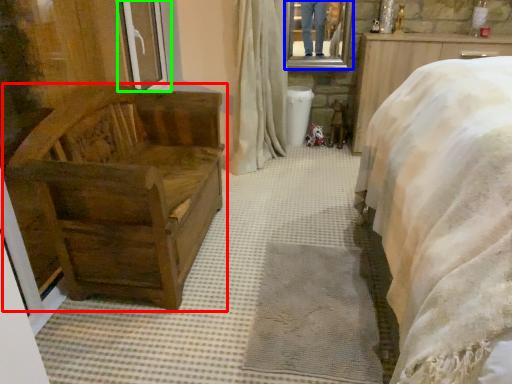
Question: Based on their relative distances, which object is nearer to furniture (highlighted by a red box)? Choose from mirror (highlighted by a blue box) and window frame (highlighted by a green box).

Choices:
 (A) mirror
 (B) window frame

Answer: (B)